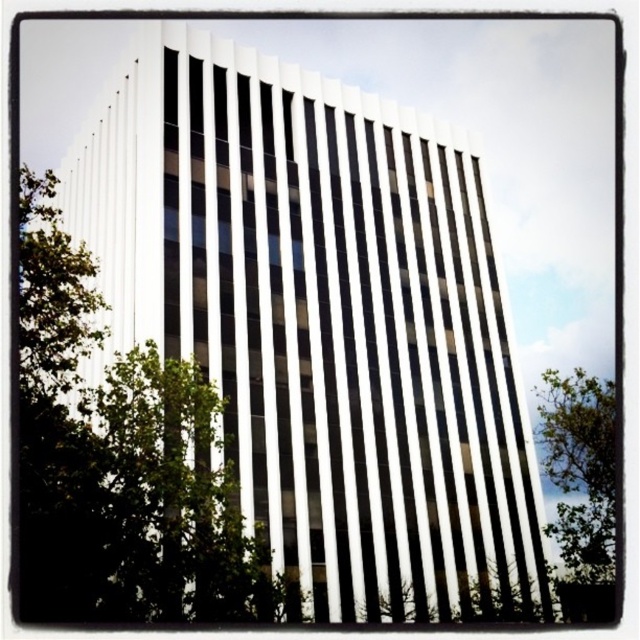
You are a drone operator trying to capture a photo of the green leafy tree at center and the green leafy tree at lower right. From your current position, which tree will appear larger in the photo?

The green leafy tree at center will appear larger in the photo because it is closer to the drone than the green leafy tree at lower right, which is further away.

You are standing at point (122, 461) in the image. What do you see directly in front of you?

You see a green leafy tree at center directly in front of you at point (122, 461).